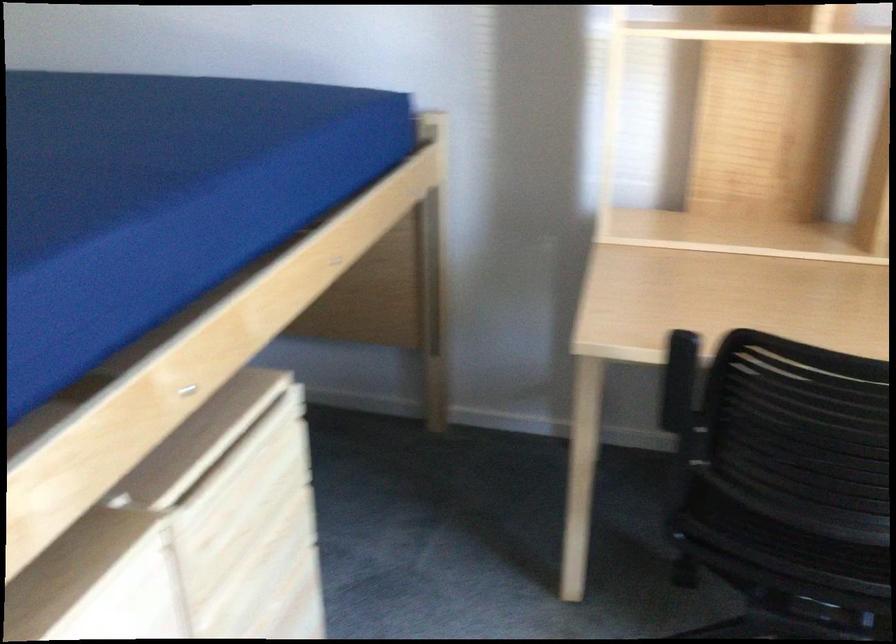
The image size is (896, 644). Identify the location of chair sitting surface. (813, 554).